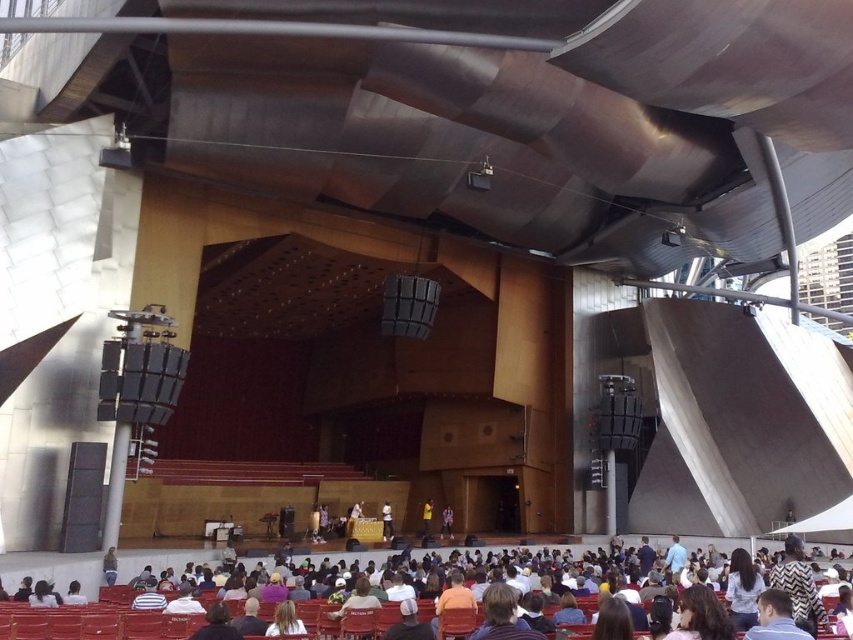
Question: Is matte red seats at lower center below white fabric shirt at center?

Choices:
 (A) yes
 (B) no

Answer: (B)

Question: Which point is closer to the camera?

Choices:
 (A) dark blue shirt at center
 (B) yellow fabric at stage center
 (C) white fabric shirt at center

Answer: (B)

Question: Which point is farther to the camera?

Choices:
 (A) (427, 515)
 (B) (381, 531)
 (C) (76, 616)

Answer: (A)

Question: Is matte red seats at lower center to the left of yellow fabric at stage center from the viewer's perspective?

Choices:
 (A) no
 (B) yes

Answer: (A)

Question: Does white fabric shirt at center have a larger size compared to dark blue shirt at center?

Choices:
 (A) no
 (B) yes

Answer: (A)

Question: Which object is farther from the camera taking this photo?

Choices:
 (A) white fabric shirt at center
 (B) yellow fabric at stage center
 (C) dark blue shirt at center

Answer: (C)